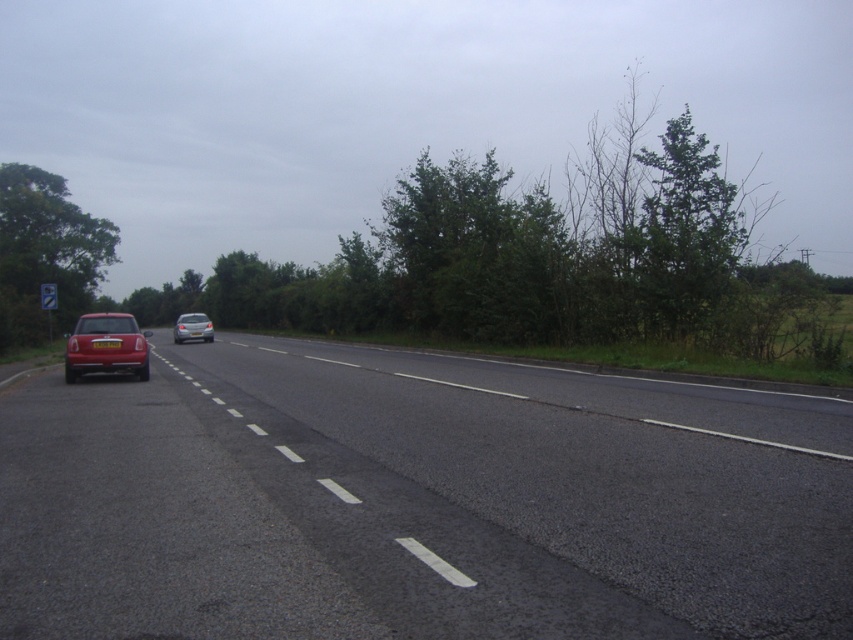
Which is more to the right, satin silver car at center or yellow matte license plate at center?

yellow matte license plate at center

Is satin silver car at center taller than yellow matte license plate at center?

Yes.

Is point (177, 326) farther from viewer compared to point (94, 344)?

That is True.

The image size is (853, 640). I want to click on satin silver car at center, so tap(192, 326).

Between smooth asphalt road at center and green leafy tree at upper right, which one appears on the left side from the viewer's perspective?

smooth asphalt road at center is more to the left.

You are a GUI agent. You are given a task and a screenshot of the screen. Output one action in this format:
    pyautogui.click(x=<x>, y=<y>)
    Task: Click on the smooth asphalt road at center
    The image size is (853, 640).
    Given the screenshot: What is the action you would take?
    pyautogui.click(x=416, y=500)

Can you confirm if green leafy tree at left is smaller than white plastic license plate at center?

Actually, green leafy tree at left might be larger than white plastic license plate at center.

Where is `green leafy tree at left`? green leafy tree at left is located at coordinates (45, 253).